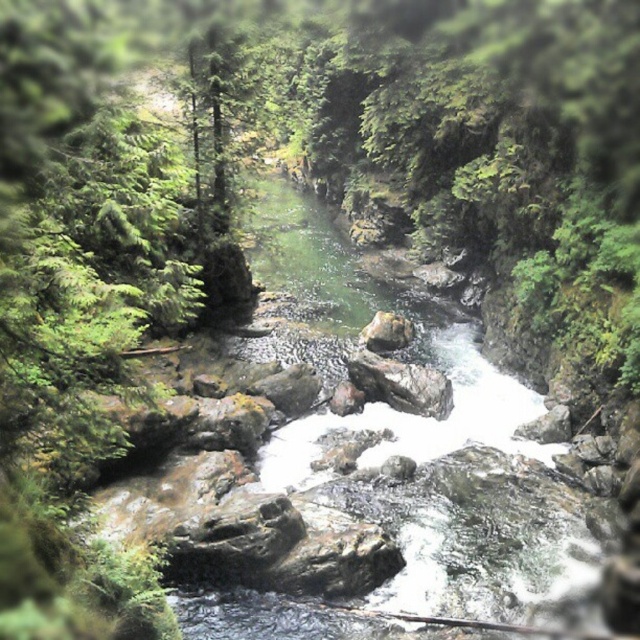
You are a hiker trying to cross the river and need to step on both the rough textured rock at center and the smooth gray rock at center. Which rock should you choose to step on first if you want to start from the wider one?

The rough textured rock at center is wider than the smooth gray rock at center, so you should step on the rough textured rock at center first.

Based on the photo, you are a hiker trying to cross the river using the rocks. You see the rough textured rock at center and the smooth gray rock at center. Which rock should you avoid stepping on to prevent slipping?

You should avoid stepping on the smooth gray rock at center because the rough textured rock at center is positioned under it, indicating the smooth one might be more slippery and less stable.